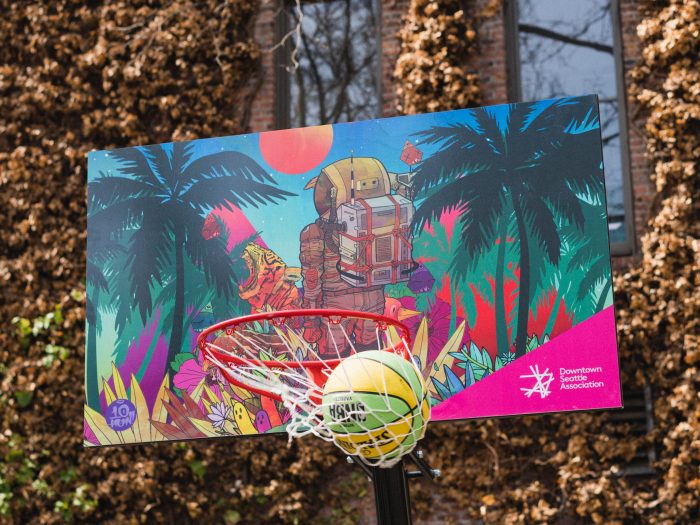
Where is `vertical black frame`? Image resolution: width=700 pixels, height=525 pixels. vertical black frame is located at coordinates (386, 498).